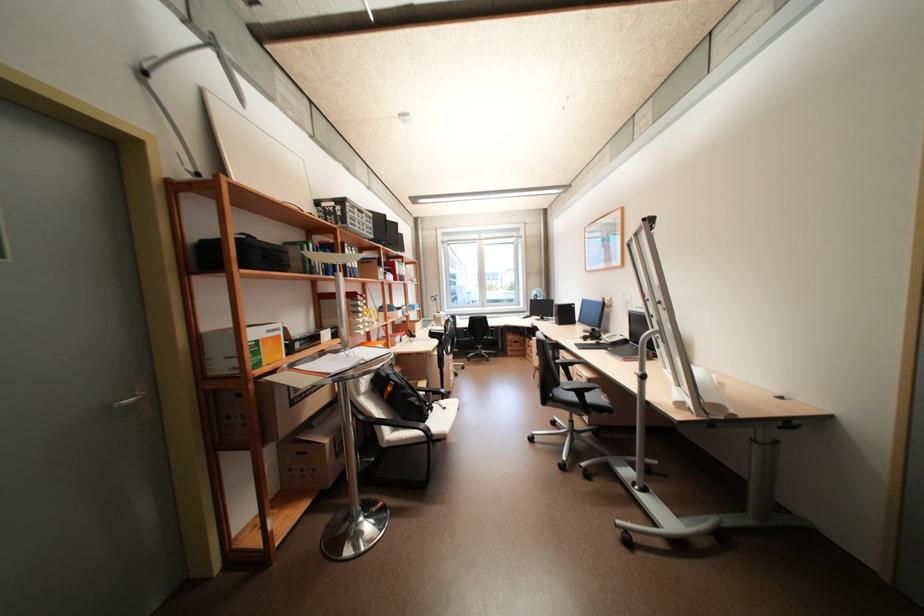
Identify the location of black backpack. The width and height of the screenshot is (924, 616). (398, 392).